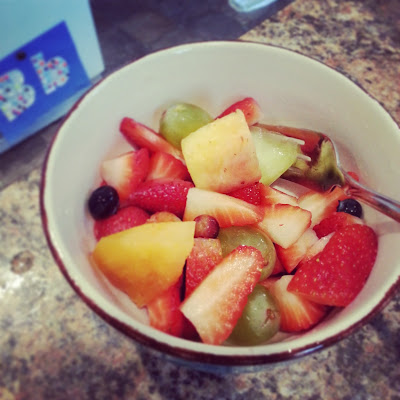
The height and width of the screenshot is (400, 400). I want to click on fruit bowl, so click(x=232, y=249).